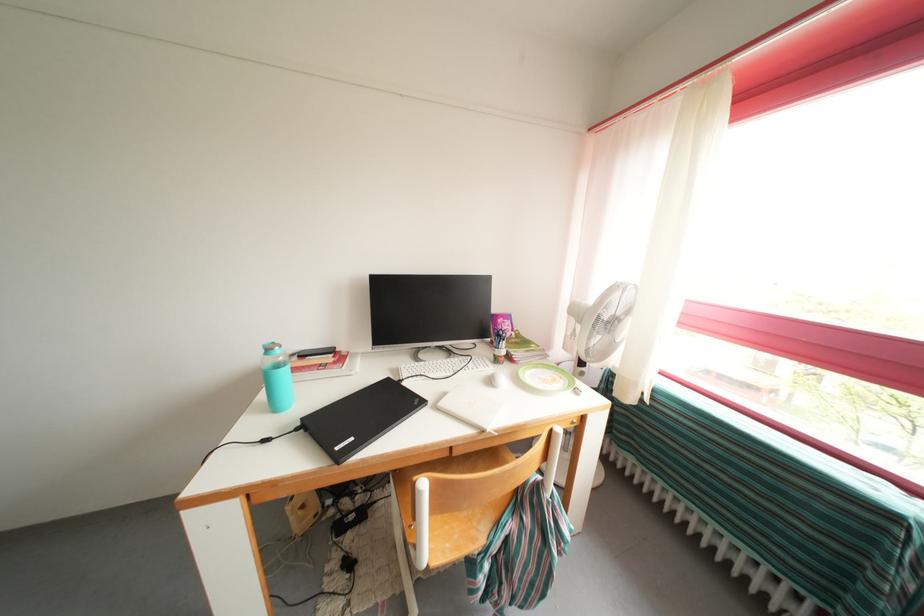
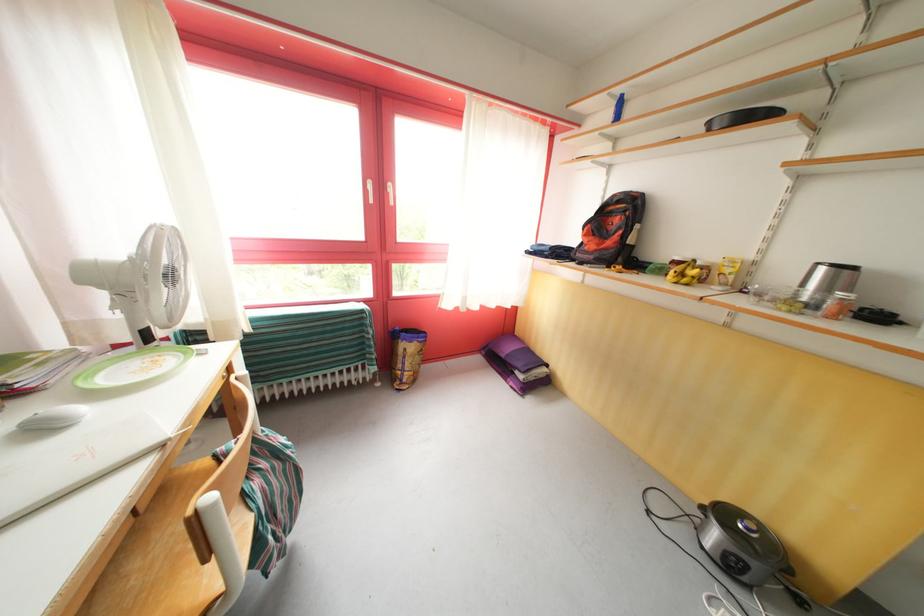
Locate, in the second image, the point that corresponds to point (480, 546) in the first image.

(251, 535)